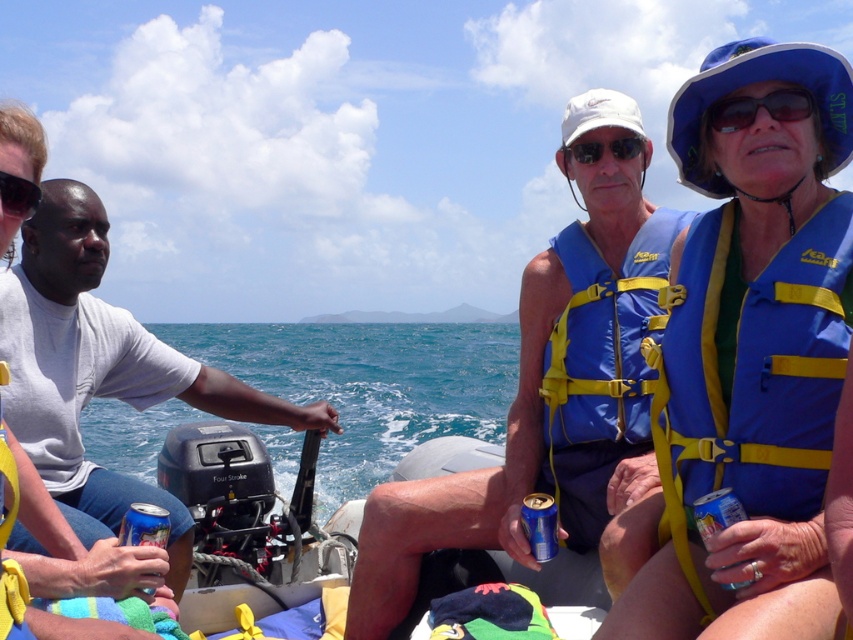
Question: Is sunglassestransparent at upper right below black plastic sunglasses at left?

Choices:
 (A) no
 (B) yes

Answer: (A)

Question: Does sunglasses at center appear over black plastic sunglasses at left?

Choices:
 (A) no
 (B) yes

Answer: (B)

Question: Is white matte shirt at left to the left of sunglassestransparent at upper right from the viewer's perspective?

Choices:
 (A) no
 (B) yes

Answer: (B)

Question: Which object is closer to the camera taking this photo?

Choices:
 (A) blue life vest at upper right
 (B) black plastic sunglasses at left
 (C) blue/yellow fabric life jacket at center
 (D) white matte shirt at left

Answer: (A)

Question: Considering the real-world distances, which object is farthest from the black plastic sunglasses at left?

Choices:
 (A) sunglasses at center
 (B) blue/yellow fabric life jacket at center

Answer: (A)

Question: Which object is farther from the camera taking this photo?

Choices:
 (A) sunglasses at center
 (B) black plastic sunglasses at left

Answer: (A)